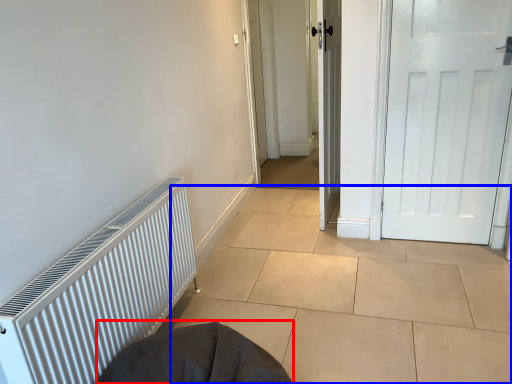
Question: Which object is closer to the camera taking this photo, sleeping bag (highlighted by a red box) or tile (highlighted by a blue box)?

Choices:
 (A) sleeping bag
 (B) tile

Answer: (A)